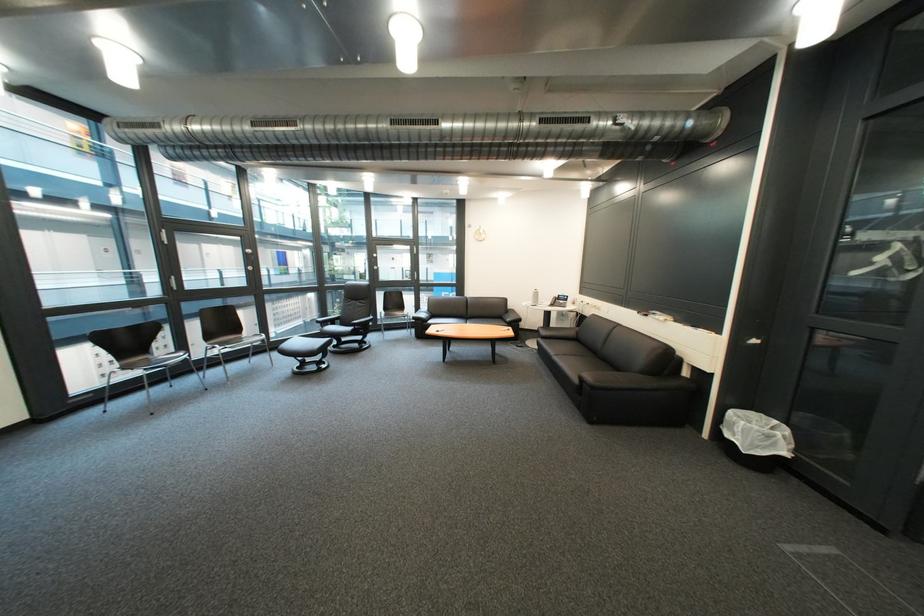
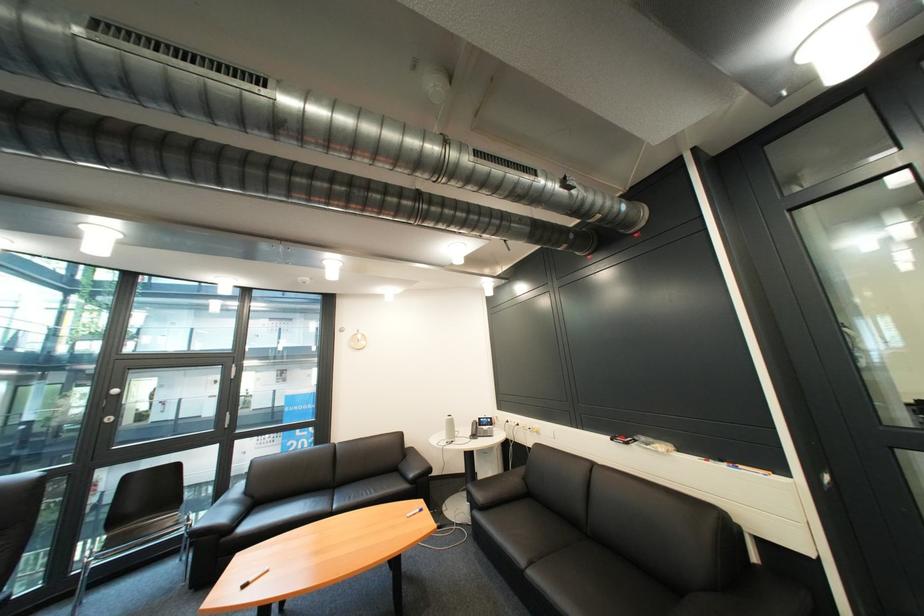
Locate, in the second image, the point that corresponds to point 611,312 in the first image.

(549, 435)